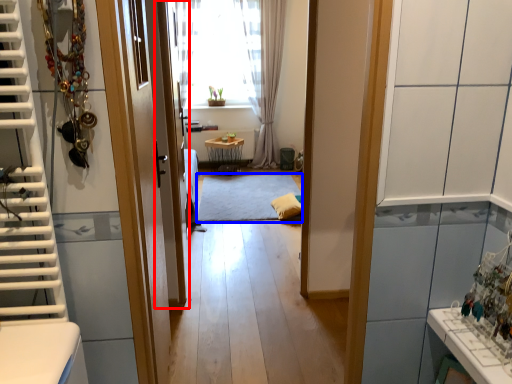
Question: Which point is further to the camera, screen door (highlighted by a red box) or mat (highlighted by a blue box)?

Choices:
 (A) screen door
 (B) mat

Answer: (B)